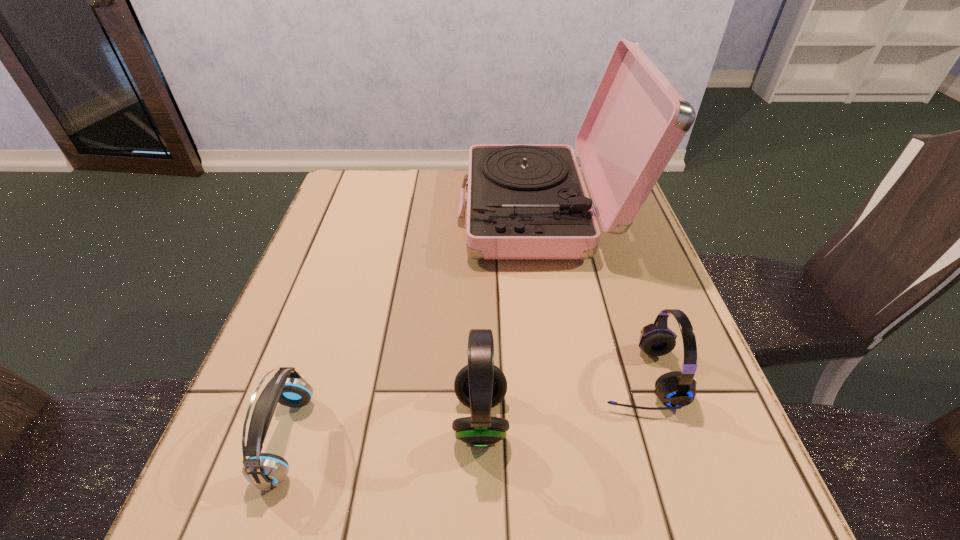
Where is `blank region between the tallest headset and the second tallest headset`? The width and height of the screenshot is (960, 540). blank region between the tallest headset and the second tallest headset is located at coordinates (560, 397).

Identify which object is the nearest to the second tallest headset. Please provide its 2D coordinates. Your answer should be formatted as a tuple, i.e. [(x, y)], where the tuple contains the x and y coordinates of a point satisfying the conditions above.

[(480, 385)]

Select which object is the closest to the leftmost object. Please provide its 2D coordinates. Your answer should be formatted as a tuple, i.e. [(x, y)], where the tuple contains the x and y coordinates of a point satisfying the conditions above.

[(480, 385)]

Locate which headset ranks in proximity to the tallest headset. Please provide its 2D coordinates. Your answer should be formatted as a tuple, i.e. [(x, y)], where the tuple contains the x and y coordinates of a point satisfying the conditions above.

[(675, 389)]

What are the coordinates of `the closest headset to the shortest object` in the screenshot? It's located at (480, 385).